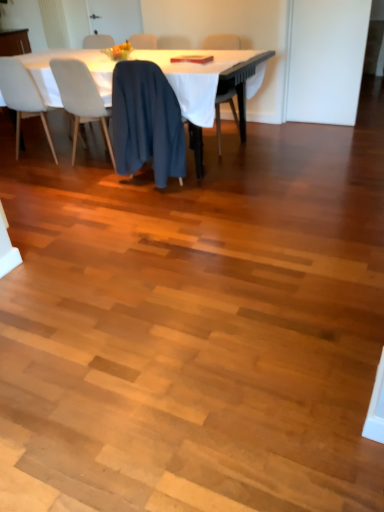
Question: From the image's perspective, is white cloth-covered table at upper center on blue fabric chair at center, which is the third chair from right to left?

Choices:
 (A) no
 (B) yes

Answer: (B)

Question: Can you confirm if white cloth-covered table at upper center is smaller than blue fabric chair at center, which is the third chair from right to left?

Choices:
 (A) yes
 (B) no

Answer: (B)

Question: Is the position of white cloth-covered table at upper center more distant than that of blue fabric chair at center, which is the third chair from right to left?

Choices:
 (A) yes
 (B) no

Answer: (B)

Question: Considering the relative positions of white cloth-covered table at upper center and blue fabric chair at center, the 2th chair when ordered from left to right, in the image provided, is white cloth-covered table at upper center to the left of blue fabric chair at center, the 2th chair when ordered from left to right, from the viewer's perspective?

Choices:
 (A) no
 (B) yes

Answer: (A)

Question: From a real-world perspective, is white cloth-covered table at upper center physically below blue fabric chair at center, which is the third chair from right to left?

Choices:
 (A) yes
 (B) no

Answer: (A)

Question: From a real-world perspective, does white cloth-covered table at upper center stand above blue fabric chair at center, which is the third chair from right to left?

Choices:
 (A) yes
 (B) no

Answer: (B)

Question: Does dark blue fabric at center, which is the second chair from right to left, appear on the left side of white cloth-covered table at upper center?

Choices:
 (A) yes
 (B) no

Answer: (B)

Question: Is dark blue fabric at center, which is the second chair from right to left, further to camera compared to white cloth-covered table at upper center?

Choices:
 (A) yes
 (B) no

Answer: (B)

Question: From the image's perspective, is dark blue fabric at center, which is the second chair from right to left, located beneath white cloth-covered table at upper center?

Choices:
 (A) no
 (B) yes

Answer: (B)

Question: Does dark blue fabric at center, placed as the third chair when sorted from left to right, have a lesser width compared to white cloth-covered table at upper center?

Choices:
 (A) no
 (B) yes

Answer: (B)

Question: Is white cloth-covered table at upper center completely or partially inside dark blue fabric at center, which is the second chair from right to left?

Choices:
 (A) yes
 (B) no

Answer: (B)

Question: Is blue fabric chair at center, the 2th chair when ordered from left to right, beside dark blue fabric at center, placed as the third chair when sorted from left to right?

Choices:
 (A) yes
 (B) no

Answer: (B)